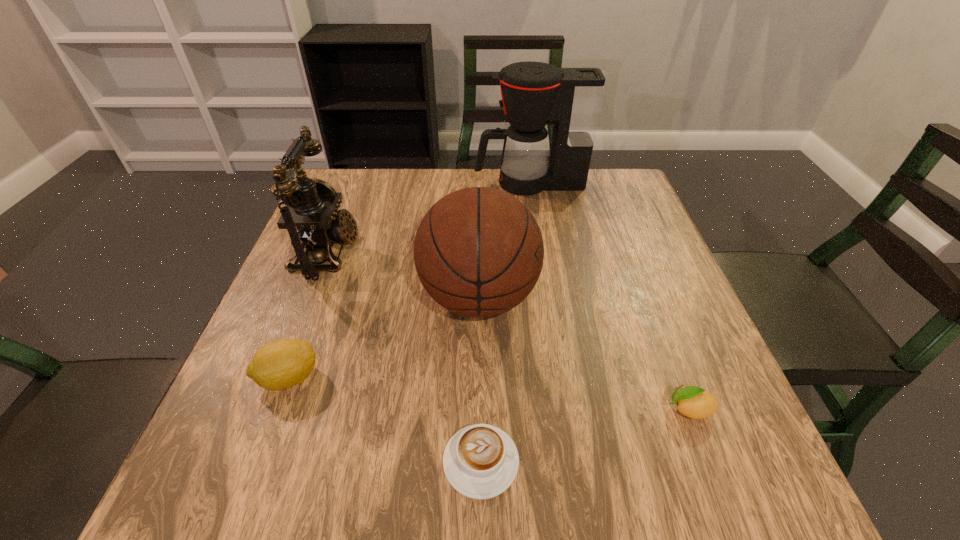
Image resolution: width=960 pixels, height=540 pixels. Identify the location of vacant space located 0.210m pour from the carafe of the coffee maker. (402, 183).

Identify the location of vacant space located on the rotary dial of the telephone. (422, 253).

Where is `vacant space situated on the side with brand label of the basketball`? vacant space situated on the side with brand label of the basketball is located at coordinates (575, 298).

You are a GUI agent. You are given a task and a screenshot of the screen. Output one action in this format:
    pyautogui.click(x=<x>, y=<y>)
    Task: Click on the vacant space situated 0.110m at the stem end of the left lemon
    The height and width of the screenshot is (540, 960).
    Given the screenshot: What is the action you would take?
    pyautogui.click(x=381, y=377)

Where is `free spot located 0.240m with leaves positioned above the rightmost object`? free spot located 0.240m with leaves positioned above the rightmost object is located at coordinates (523, 409).

Where is `free region located with leaves positioned above the rightmost object`? The width and height of the screenshot is (960, 540). free region located with leaves positioned above the rightmost object is located at coordinates (559, 409).

Locate an element on the screen. This screenshot has width=960, height=540. vacant space situated 0.270m with leaves positioned above the rightmost object is located at coordinates (505, 409).

Find the location of a particular element. vacant region located with the handle on the right side of the cappuccino is located at coordinates (629, 462).

Where is `object that is at the far edge`? The image size is (960, 540). object that is at the far edge is located at coordinates (533, 93).

Where is `object located in the near edge section of the desktop`? This screenshot has width=960, height=540. object located in the near edge section of the desktop is located at coordinates (480, 461).